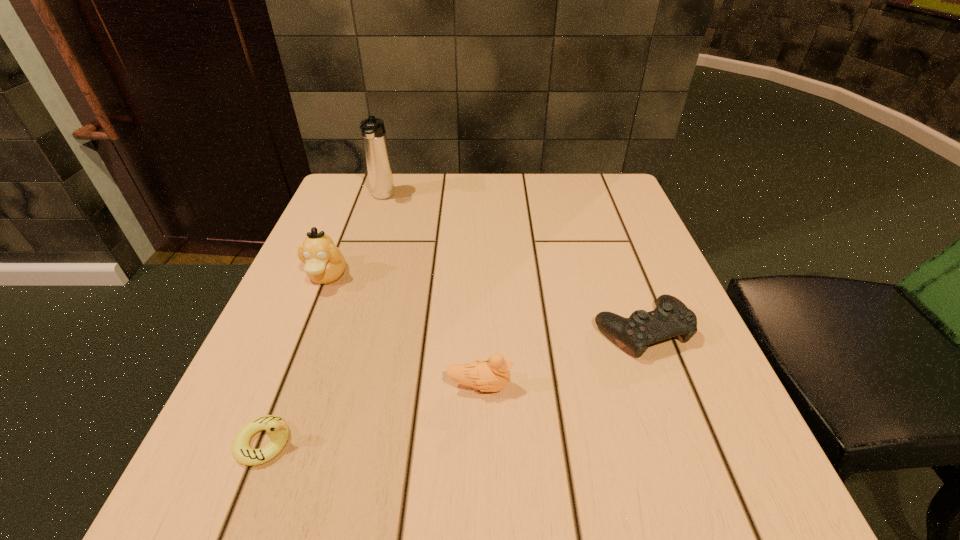
This screenshot has width=960, height=540. Find the location of `the tallest object`. the tallest object is located at coordinates (375, 144).

At what (x,y) coordinates should I click in order to perform the action: click on the farthest object. Please return your answer as a coordinate pair (x, y). Looking at the image, I should click on (375, 144).

Image resolution: width=960 pixels, height=540 pixels. In order to click on the farthest duckling in this screenshot , I will do point(324,263).

Find the location of a particular element. Image resolution: width=960 pixels, height=540 pixels. the tallest duckling is located at coordinates (324, 263).

Where is `the third tallest object`? The height and width of the screenshot is (540, 960). the third tallest object is located at coordinates coord(492,375).

This screenshot has width=960, height=540. What are the coordinates of `the second nearest object` in the screenshot? It's located at (492, 375).

The image size is (960, 540). I want to click on the third farthest object, so click(x=671, y=317).

Where is `the rightmost object`? This screenshot has height=540, width=960. the rightmost object is located at coordinates 671,317.

At what (x,y) coordinates should I click in order to perform the action: click on the shortest object. Please return your answer as a coordinate pair (x, y). Looking at the image, I should click on (x=277, y=429).

Identify the location of the nearest object. (277, 429).